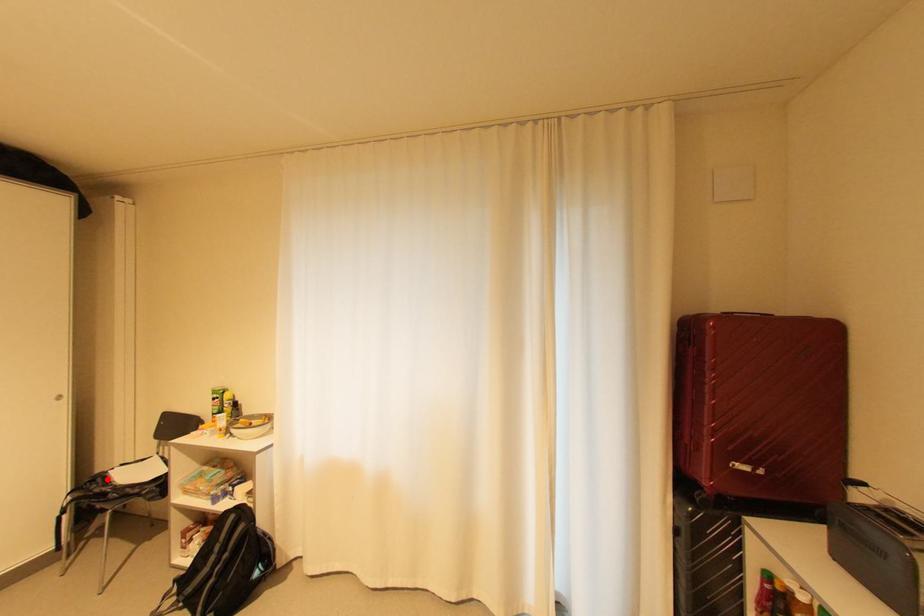
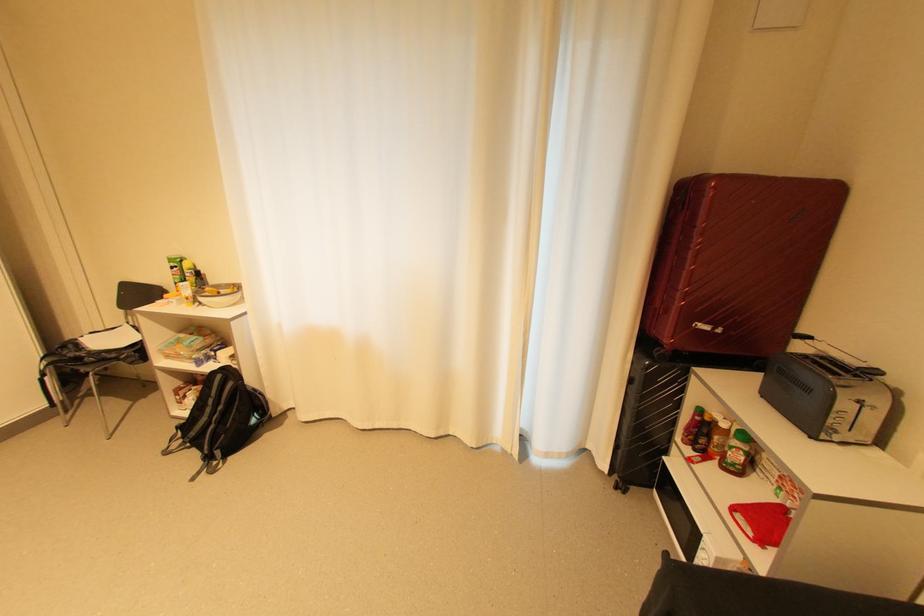
Where in the second image is the point corresponding to the highlighted location from the first image?

(79, 346)